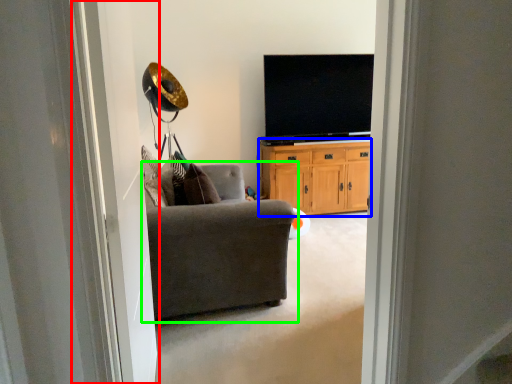
Question: Considering the real-world distances, which object is closest to screen door (highlighted by a red box)? cabinetry (highlighted by a blue box) or chair (highlighted by a green box).

Choices:
 (A) cabinetry
 (B) chair

Answer: (B)